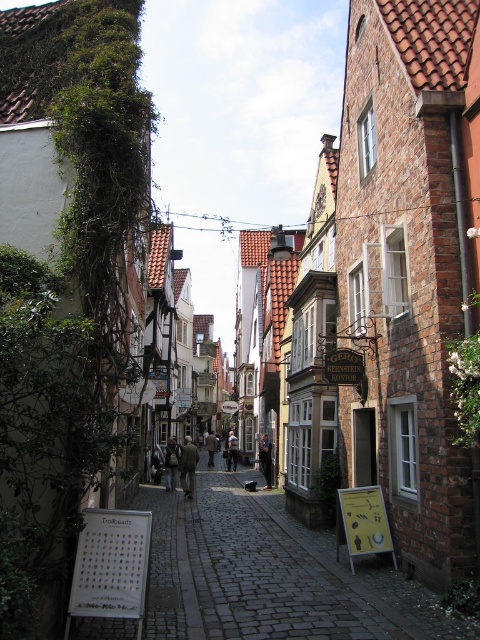
Question: Which object appears farthest from the camera in this image?

Choices:
 (A) dark gray fabric coat at center
 (B) dark brown leather jacket at center

Answer: (B)

Question: Does dark brown leather coat at center have a smaller size compared to dark brown leather jacket at center?

Choices:
 (A) yes
 (B) no

Answer: (B)

Question: Which object is farther from the camera taking this photo?

Choices:
 (A) dark gray fabric coat at center
 (B) brown wool coat at center
 (C) dark cobblestone alley at center
 (D) dark brown leather jacket at center

Answer: (B)

Question: Can you confirm if dark cobblestone alley at center is positioned to the left of dark gray fabric coat at center?

Choices:
 (A) yes
 (B) no

Answer: (A)

Question: Can you confirm if light brown leather jacket at center is bigger than dark brown leather jacket at center?

Choices:
 (A) yes
 (B) no

Answer: (B)

Question: Which point appears farthest from the camera in this image?

Choices:
 (A) tap(210, 432)
 (B) tap(263, 627)

Answer: (A)